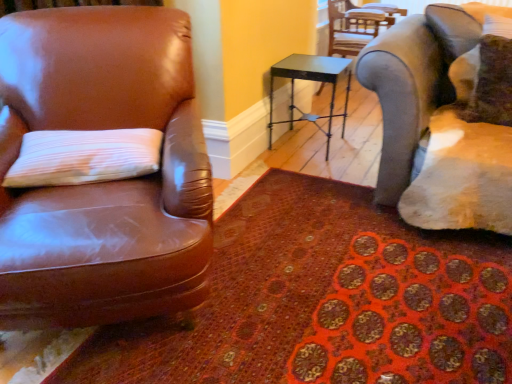
Question: Is patterned carpet at lower left inside or outside of brown leather chair at left, the 2th chair in the right-to-left sequence?

Choices:
 (A) inside
 (B) outside

Answer: (B)

Question: Based on their sizes in the image, would you say patterned carpet at lower left is bigger or smaller than brown leather chair at left, the first chair from the left?

Choices:
 (A) small
 (B) big

Answer: (A)

Question: Estimate the real-world distances between objects in this image. Which object is closer to the velvet brown pillow at upper right, positioned as the 1th pillow in top-to-bottom order?

Choices:
 (A) metallic black table at center
 (B) metallic gray chair at upper right, placed as the 1th chair when sorted from back to front
 (C) brown leather chair at left, acting as the 1th chair starting from the front
 (D) patterned carpet at lower left
 (E) white textured pillow at left, which is the 1th pillow in front-to-back order

Answer: (A)

Question: Which object is the closest to the velvet brown pillow at upper right, placed as the 2th pillow when sorted from left to right?

Choices:
 (A) white textured pillow at left, the second pillow in the back-to-front sequence
 (B) brown leather chair at left, acting as the 2th chair starting from the back
 (C) metallic black table at center
 (D) patterned carpet at lower left
 (E) metallic gray chair at upper right, the 2th chair positioned from the left

Answer: (C)